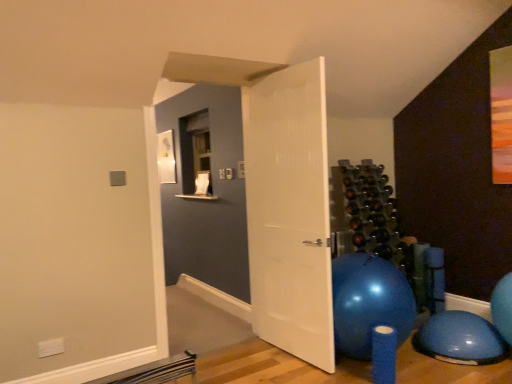
Question: Is blue rubber ball at lower right situated inside white textured door at center or outside?

Choices:
 (A) inside
 (B) outside

Answer: (B)

Question: Is blue rubber ball at lower right bigger or smaller than white textured door at center?

Choices:
 (A) big
 (B) small

Answer: (B)

Question: In terms of height, does blue rubber ball at lower right look taller or shorter compared to white textured door at center?

Choices:
 (A) short
 (B) tall

Answer: (A)

Question: Do you think white textured door at center is within blue rubber ball at lower right, or outside of it?

Choices:
 (A) outside
 (B) inside

Answer: (A)

Question: In the image, is white textured door at center on the left side or the right side of blue rubber ball at lower right?

Choices:
 (A) right
 (B) left

Answer: (B)

Question: Considering the positions of point pos(262,296) and point pos(460,332), is point pos(262,296) closer or farther from the camera than point pos(460,332)?

Choices:
 (A) farther
 (B) closer

Answer: (A)

Question: Based on their sizes in the image, would you say white textured door at center is bigger or smaller than blue rubber ball at lower right?

Choices:
 (A) big
 (B) small

Answer: (A)